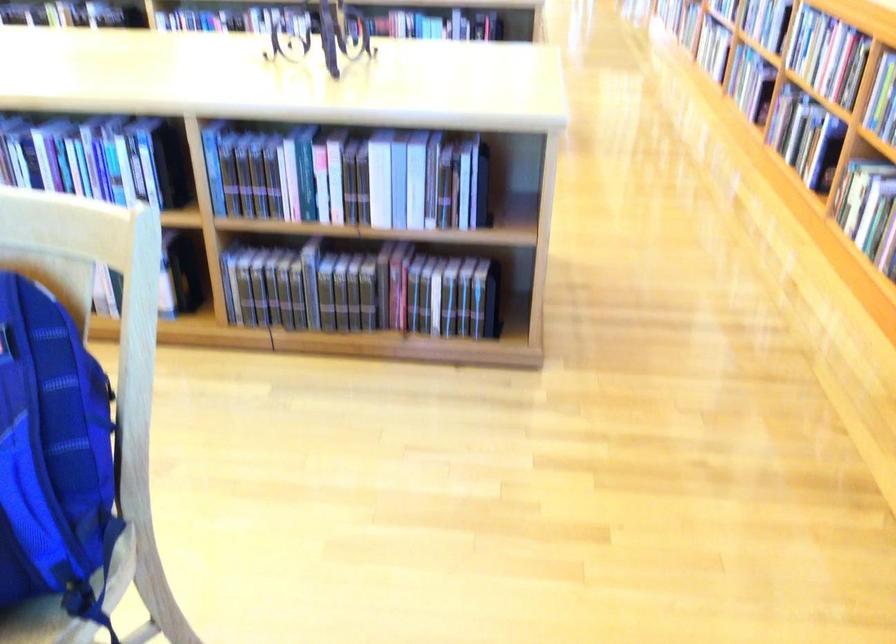
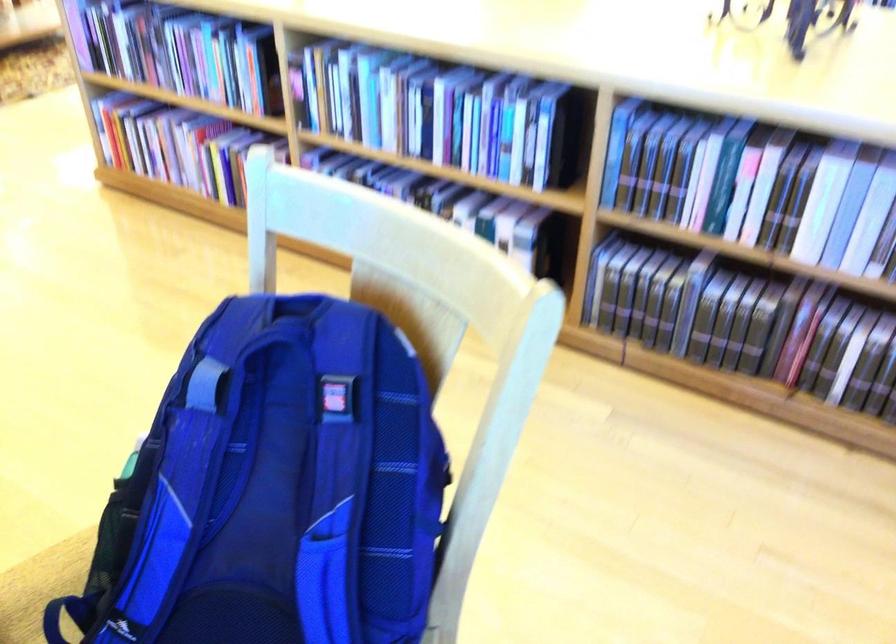
The images are taken continuously from a first-person perspective. In which direction are you moving?

The cameraman walked toward left, forward.